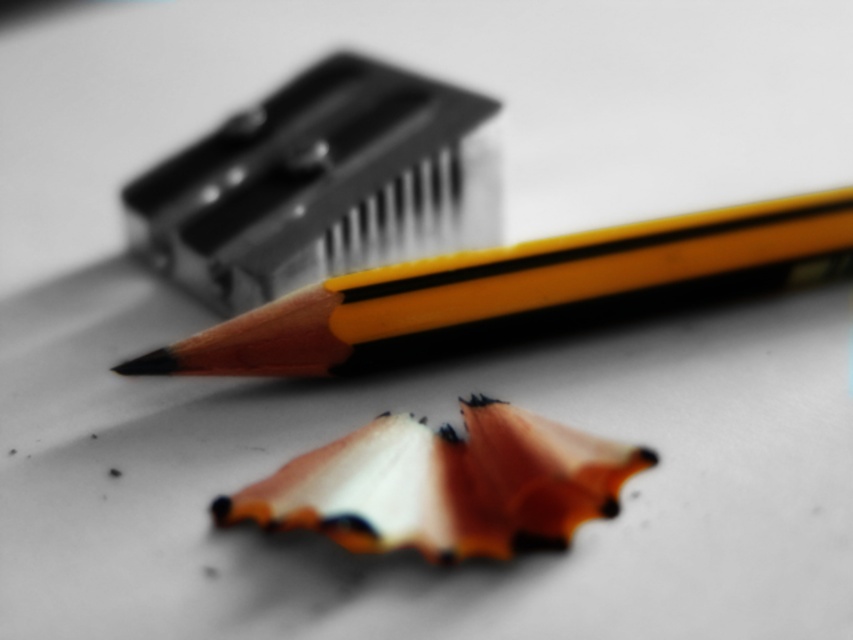
You are an artist trying to locate your matte yellow pencil at upper center for a drawing. Based on the coordinates provided, where would you look in the image to find it?

The matte yellow pencil at upper center is located at point coordinates (318, 186) in the image.

You are an artist trying to choose between the wooden pencil at center and the orange wood pencil at center based on their sizes. Which pencil is taller?

The wooden pencil at center is taller than the orange wood pencil at center.